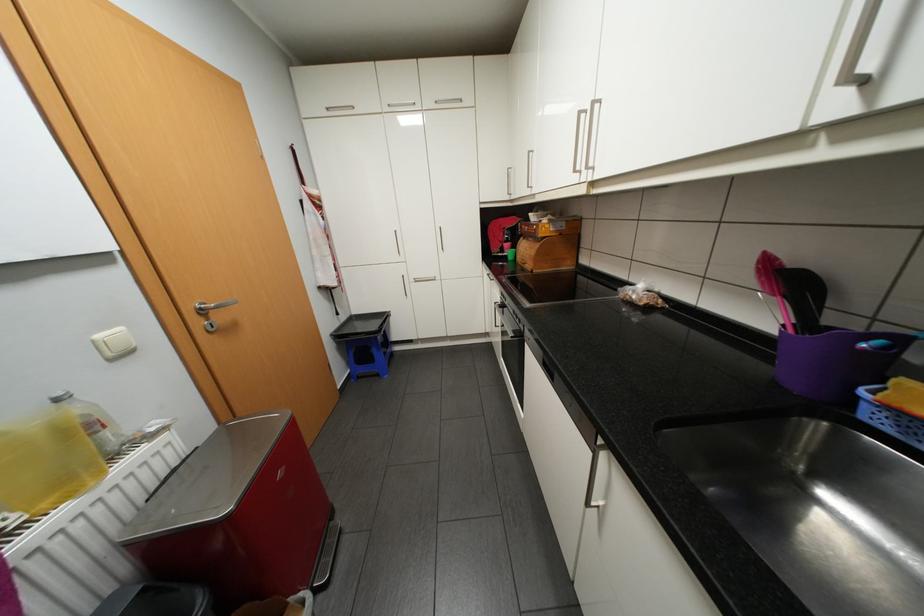
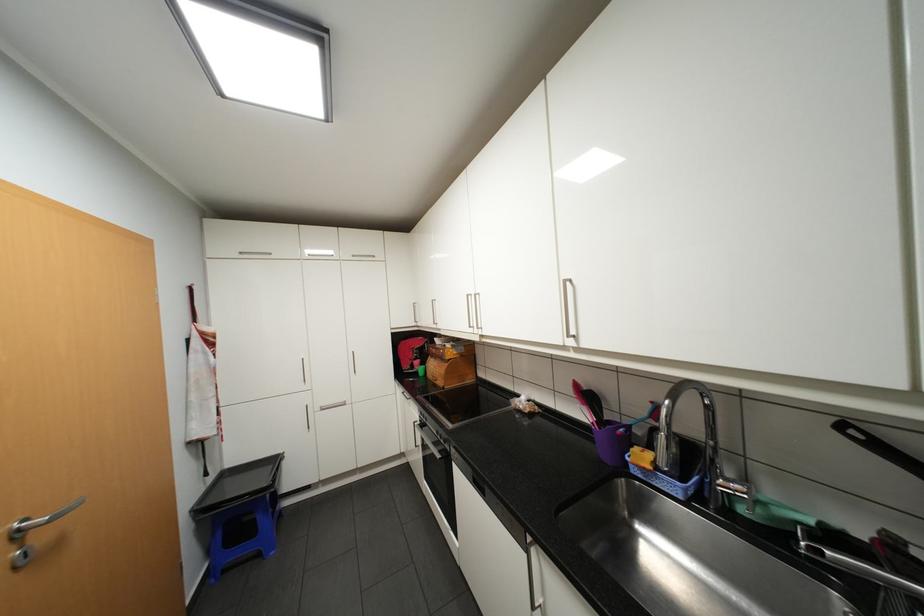
Where in the second image is the point corresponding to [350,315] from the first image?

(220, 476)